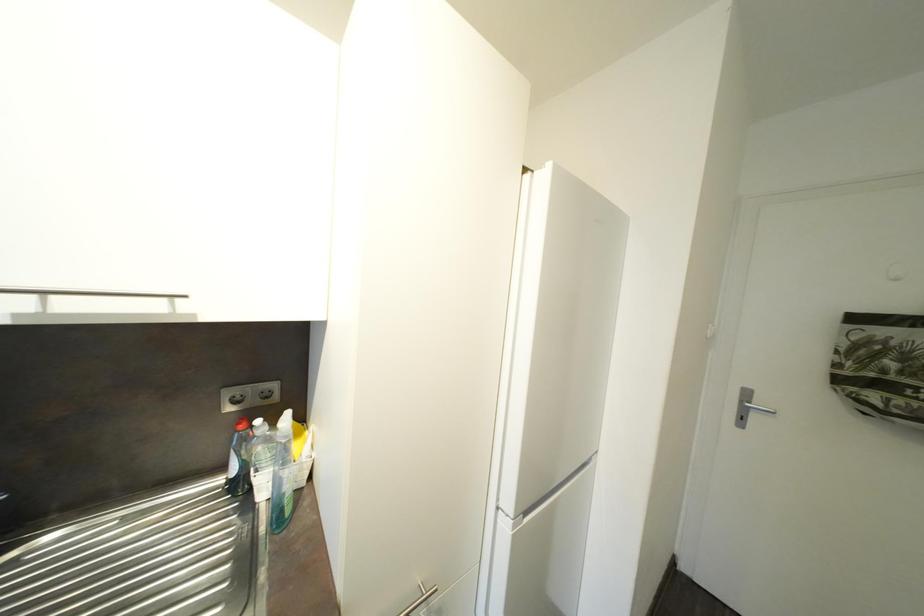
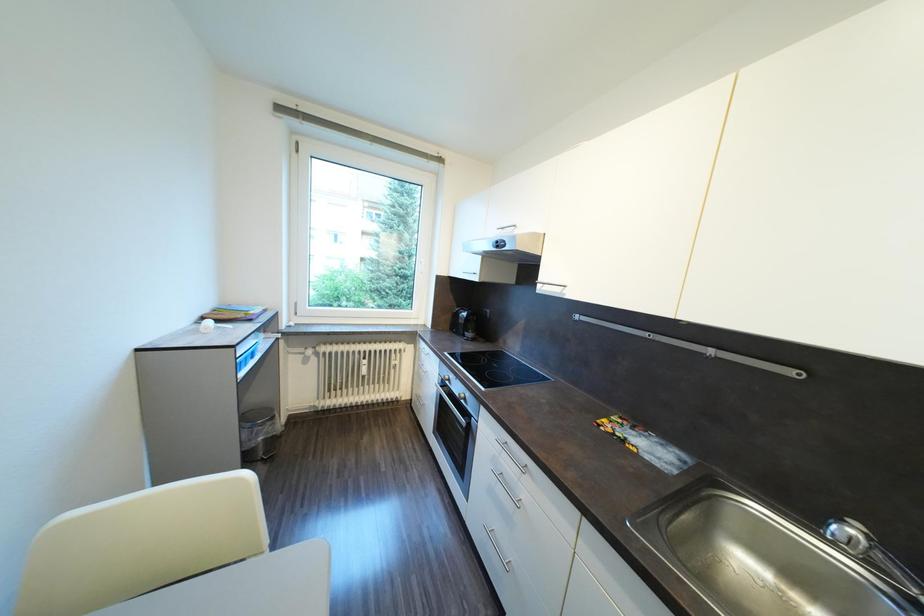
Question: How did the camera likely rotate?

Choices:
 (A) Left
 (B) Right
 (C) Up
 (D) Down

Answer: (A)